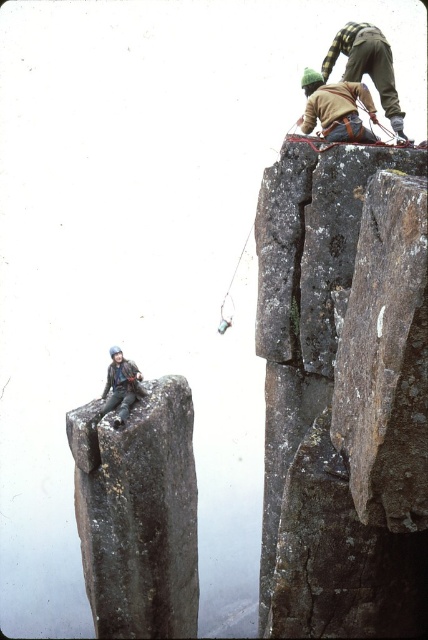
You are a rock climber assessing the safety of your gear. You notice the dark gray rock at left and the matte black jacket at left. Which object is wider?

The dark gray rock at left is wider than the matte black jacket at left, as its width surpasses the jacket.

You are a climber assessing the route. You see the dark gray rock at left and the matte black jacket at left. Which object is more to the left?

The matte black jacket at left is more to the left because the dark gray rock at left is positioned on its right side.